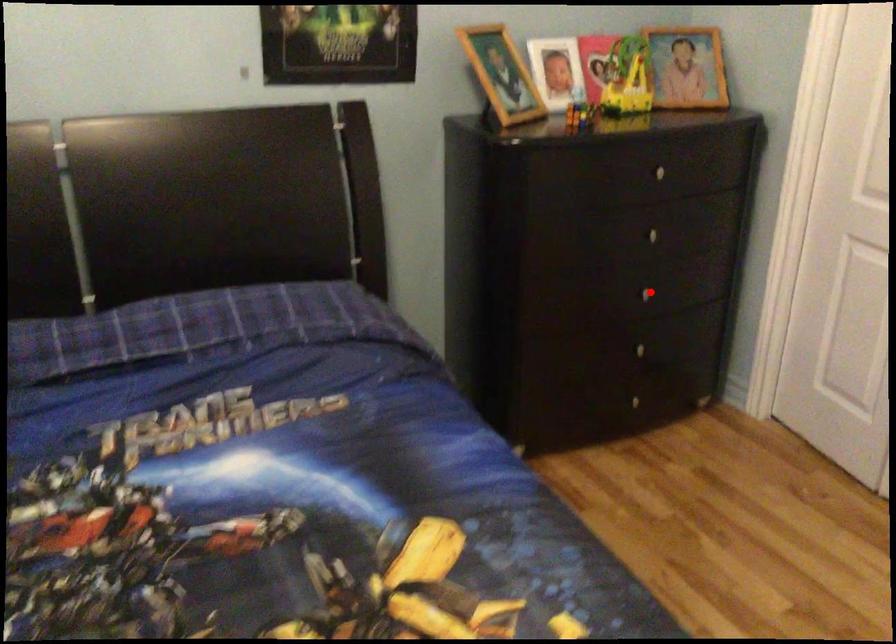
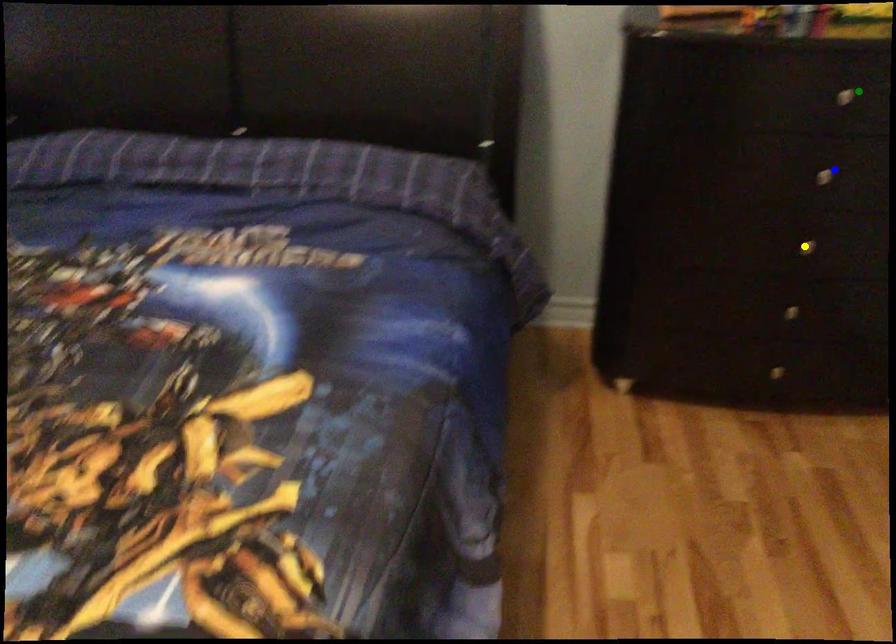
Question: I am providing you with two images of the same scene from different viewpoints. A red point is marked on the first image. You are given multiple points on the second image. Can you choose the point in image 2 that corresponds to the point in image 1?

Choices:
 (A) blue point
 (B) green point
 (C) yellow point

Answer: (C)